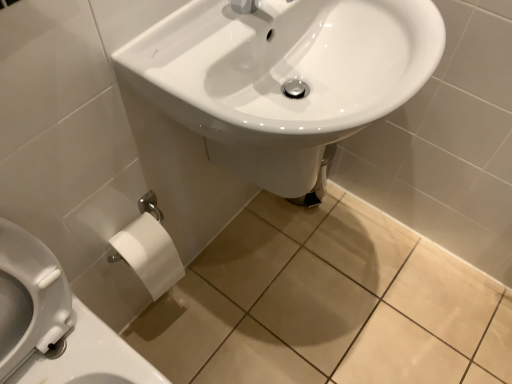
Question: Looking at the image, does white paper at lower left seem bigger or smaller compared to white glossy sink at center?

Choices:
 (A) small
 (B) big

Answer: (A)

Question: Looking at their shapes, would you say white paper at lower left is wider or thinner than white glossy sink at center?

Choices:
 (A) thin
 (B) wide

Answer: (B)

Question: Estimate the real-world distances between objects in this image. Which object is farther from the white paper at lower left?

Choices:
 (A) white glossy sink at center
 (B) white matte toilet paper at lower left

Answer: (A)

Question: Estimate the real-world distances between objects in this image. Which object is farther from the white matte toilet paper at lower left?

Choices:
 (A) white glossy sink at center
 (B) white paper at lower left

Answer: (A)